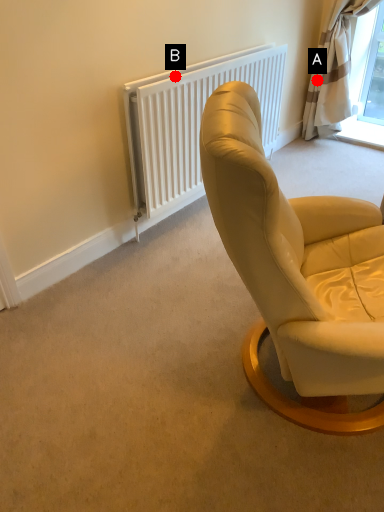
Question: Two points are circled on the image, labeled by A and B beside each circle. Which of the following is the farthest from the observer?

Choices:
 (A) A is further
 (B) B is further

Answer: (A)